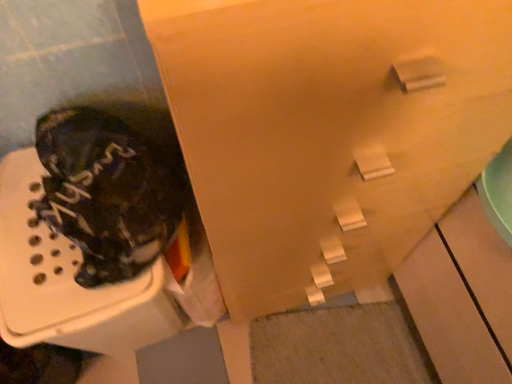
Question: Can you confirm if camouflage fabric boot at left is thinner than matte wood cabinet at upper center?

Choices:
 (A) no
 (B) yes

Answer: (B)

Question: Does camouflage fabric boot at left have a larger size compared to matte wood cabinet at upper center?

Choices:
 (A) yes
 (B) no

Answer: (B)

Question: Is camouflage fabric boot at left next to matte wood cabinet at upper center?

Choices:
 (A) no
 (B) yes

Answer: (A)

Question: Does camouflage fabric boot at left have a smaller size compared to matte wood cabinet at upper center?

Choices:
 (A) yes
 (B) no

Answer: (A)

Question: Is camouflage fabric boot at left oriented away from matte wood cabinet at upper center?

Choices:
 (A) no
 (B) yes

Answer: (A)

Question: Does camouflage fabric boot at left have a greater height compared to matte wood cabinet at upper center?

Choices:
 (A) yes
 (B) no

Answer: (B)

Question: Can you confirm if matte wood cabinet at upper center is positioned to the right of camouflage fabric boot at left?

Choices:
 (A) yes
 (B) no

Answer: (A)

Question: From the image's perspective, is matte wood cabinet at upper center located above camouflage fabric boot at left?

Choices:
 (A) yes
 (B) no

Answer: (A)

Question: Does matte wood cabinet at upper center contain camouflage fabric boot at left?

Choices:
 (A) yes
 (B) no

Answer: (B)

Question: Could you tell me if matte wood cabinet at upper center is facing camouflage fabric boot at left?

Choices:
 (A) no
 (B) yes

Answer: (A)

Question: Is camouflage fabric boot at left at the back of matte wood cabinet at upper center?

Choices:
 (A) yes
 (B) no

Answer: (B)

Question: Is matte wood cabinet at upper center positioned before camouflage fabric boot at left?

Choices:
 (A) yes
 (B) no

Answer: (A)

Question: From a real-world perspective, relative to matte wood cabinet at upper center, is camouflage fabric boot at left vertically above or below?

Choices:
 (A) below
 (B) above

Answer: (B)